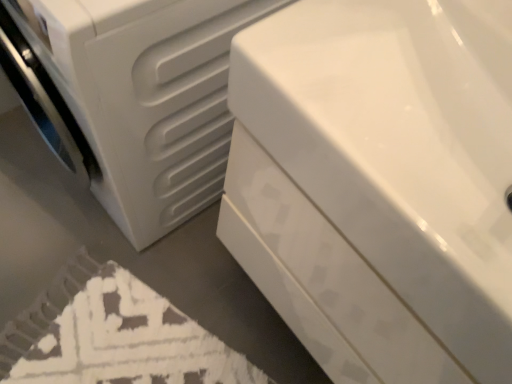
At what (x,y) coordinates should I click in order to perform the action: click on vacant space underneath white textured bath mat at lower left (from a real-world perspective). Please return your answer as a coordinate pair (x, y). The image size is (512, 384). Looking at the image, I should click on (111, 348).